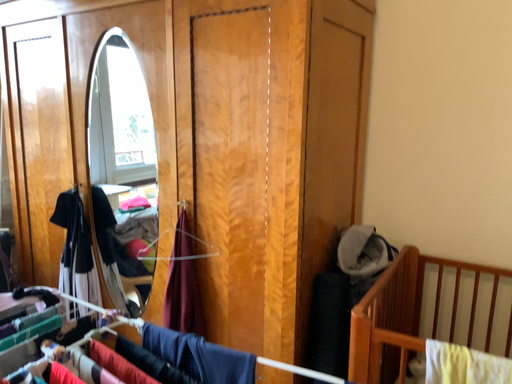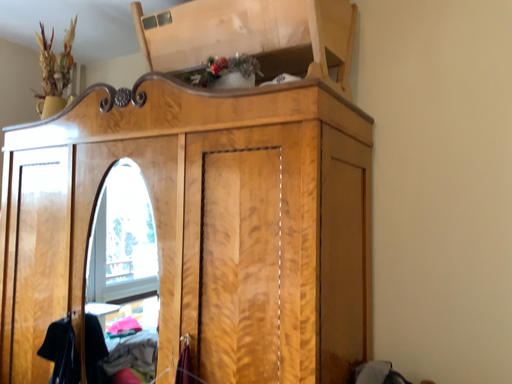
Question: Which way did the camera rotate in the video?

Choices:
 (A) rotated upward
 (B) rotated downward

Answer: (A)